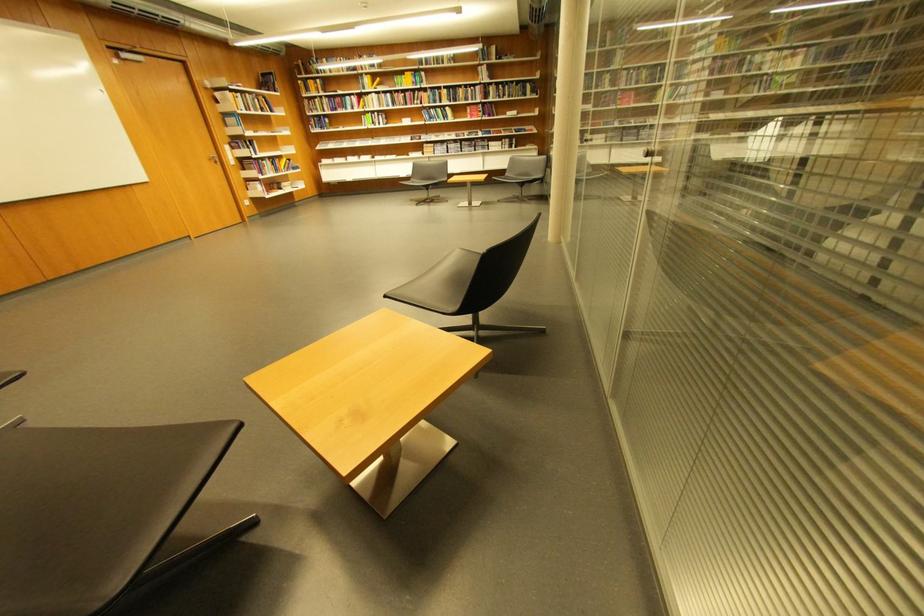
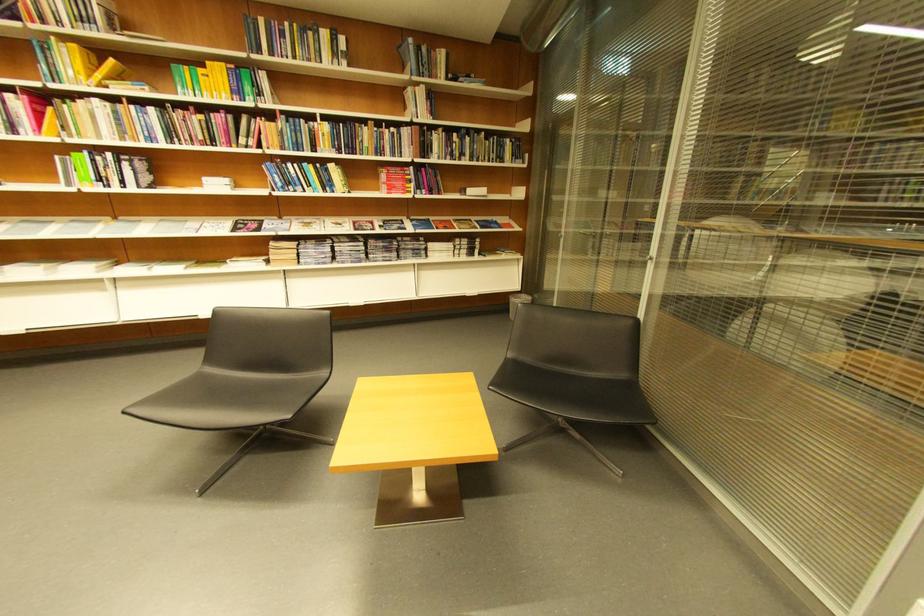
Where in the second image is the point corresponding to [490,70] from the first image?

(419, 91)